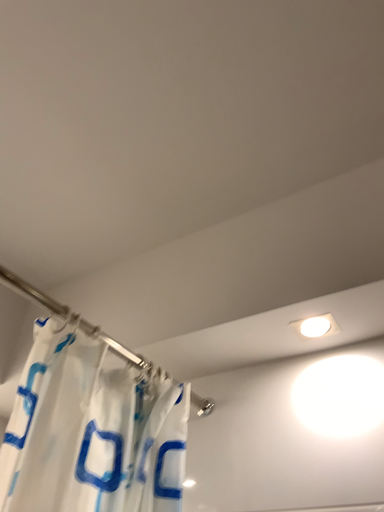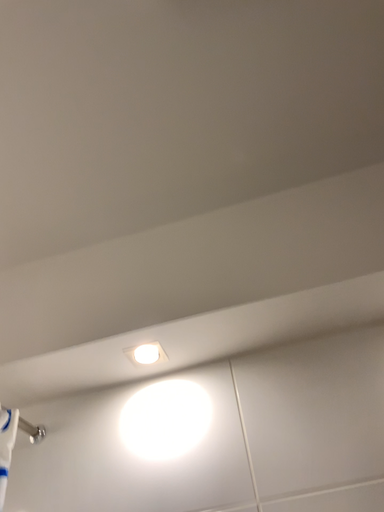
Question: How did the camera likely rotate when shooting the video?

Choices:
 (A) rotated left
 (B) rotated right

Answer: (B)